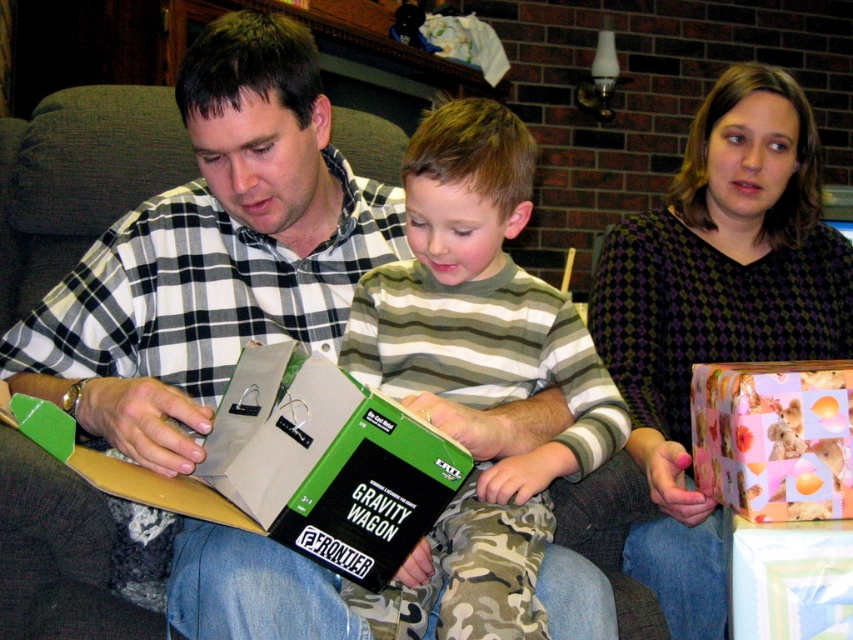
Question: Which of the following is the closest to the observer?

Choices:
 (A) (614, 333)
 (B) (454, 227)
 (C) (706, 401)

Answer: (B)

Question: Considering the real-world distances, which object is closest to the pink paper gift at right?

Choices:
 (A) dark purple checkered sweater at upper right
 (B) green matte box at center
 (C) green striped shirt at center

Answer: (A)

Question: Can you confirm if green striped shirt at center is positioned to the right of green matte box at center?

Choices:
 (A) no
 (B) yes

Answer: (B)

Question: Among these objects, which one is farthest from the camera?

Choices:
 (A) green matte box at center
 (B) pink paper gift at right
 (C) dark purple checkered sweater at upper right
 (D) green striped shirt at center

Answer: (C)

Question: Can you confirm if green matte box at center is positioned below pink paper gift at right?

Choices:
 (A) yes
 (B) no

Answer: (B)

Question: Can you confirm if green matte box at center is bigger than pink paper gift at right?

Choices:
 (A) yes
 (B) no

Answer: (A)